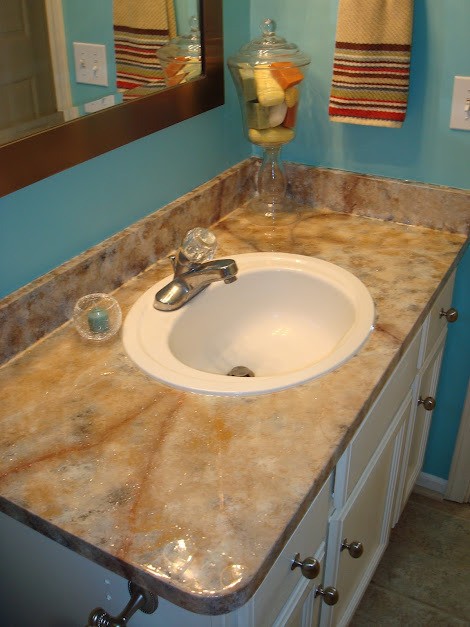
Locate an element on the screen. The width and height of the screenshot is (470, 627). knob is located at coordinates (309, 571).